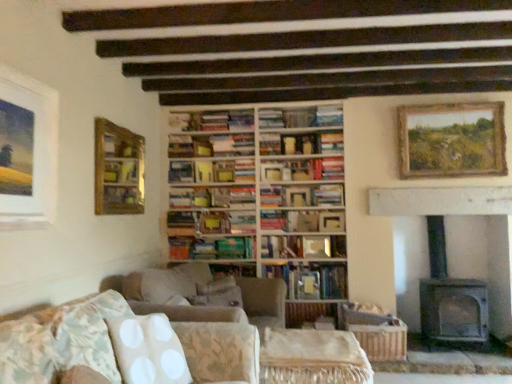
Question: Is hardcover book at center, the fifth book viewed from the top, not close to gray stone fireplace at right?

Choices:
 (A) no
 (B) yes

Answer: (A)

Question: Is hardcover book at center, placed as the 3th book when sorted from bottom to top, at the right side of gray stone fireplace at right?

Choices:
 (A) yes
 (B) no

Answer: (B)

Question: Is hardcover book at center, placed as the 3th book when sorted from bottom to top, thinner than gray stone fireplace at right?

Choices:
 (A) yes
 (B) no

Answer: (A)

Question: Does hardcover book at center, the fifth book viewed from the top, contain gray stone fireplace at right?

Choices:
 (A) no
 (B) yes

Answer: (A)

Question: Is hardcover book at center, placed as the 3th book when sorted from bottom to top, oriented away from gray stone fireplace at right?

Choices:
 (A) no
 (B) yes

Answer: (A)

Question: From the image's perspective, relative to green matte book at center, the sixth book viewed from the top, is wooden-framed painting at upper right, which appears as the 2th picture frame when viewed from the front, above or below?

Choices:
 (A) below
 (B) above

Answer: (B)

Question: Does point (438, 109) appear closer or farther from the camera than point (197, 244)?

Choices:
 (A) farther
 (B) closer

Answer: (B)

Question: Is wooden-framed painting at upper right, which appears as the 2th picture frame when viewed from the front, spatially inside green matte book at center, the second book in the bottom-to-top sequence, or outside of it?

Choices:
 (A) outside
 (B) inside

Answer: (A)

Question: From a real-world perspective, is wooden-framed painting at upper right, which appears as the 2th picture frame when viewed from the front, positioned above or below green matte book at center, the sixth book viewed from the top?

Choices:
 (A) below
 (B) above

Answer: (B)

Question: Is hardcover book at center, the third book when ordered from top to bottom, wider or thinner than matte white picture frame at upper left, which is the first picture frame in left-to-right order?

Choices:
 (A) wide
 (B) thin

Answer: (A)

Question: Would you say hardcover book at center, the third book when ordered from top to bottom, is to the left or to the right of matte white picture frame at upper left, which is the 1th picture frame from front to back, in the picture?

Choices:
 (A) right
 (B) left

Answer: (A)

Question: Considering the positions of point (268, 193) and point (7, 67), is point (268, 193) closer or farther from the camera than point (7, 67)?

Choices:
 (A) farther
 (B) closer

Answer: (A)

Question: From the image's perspective, is hardcover book at center, the third book when ordered from top to bottom, above or below matte white picture frame at upper left, which is the 1th picture frame from front to back?

Choices:
 (A) below
 (B) above

Answer: (A)

Question: From a real-world perspective, is hardcover book at center, acting as the 6th book starting from the bottom, physically located above or below hardcover books at center, placed as the first book when sorted from top to bottom?

Choices:
 (A) above
 (B) below

Answer: (B)

Question: Is point (313, 198) positioned closer to the camera than point (187, 127)?

Choices:
 (A) farther
 (B) closer

Answer: (B)